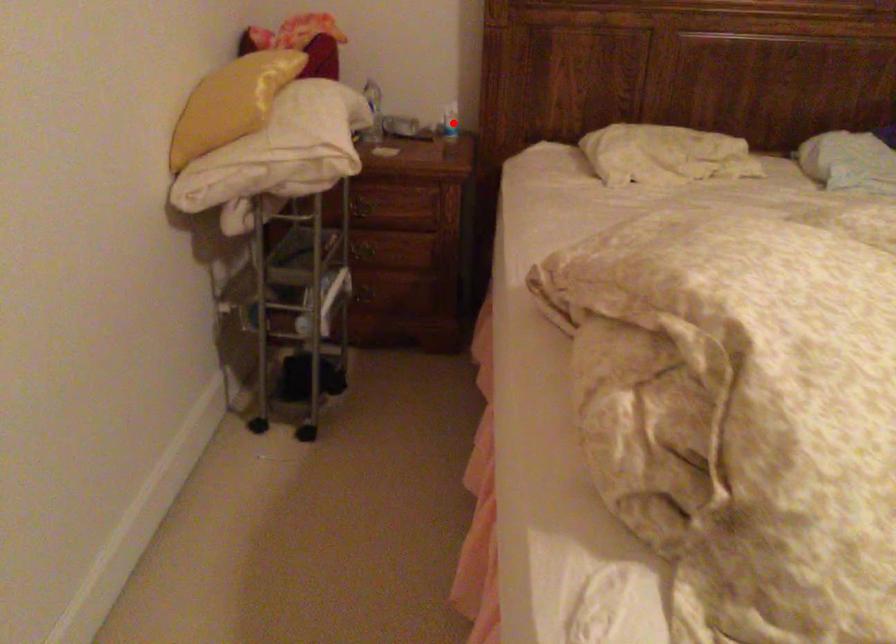
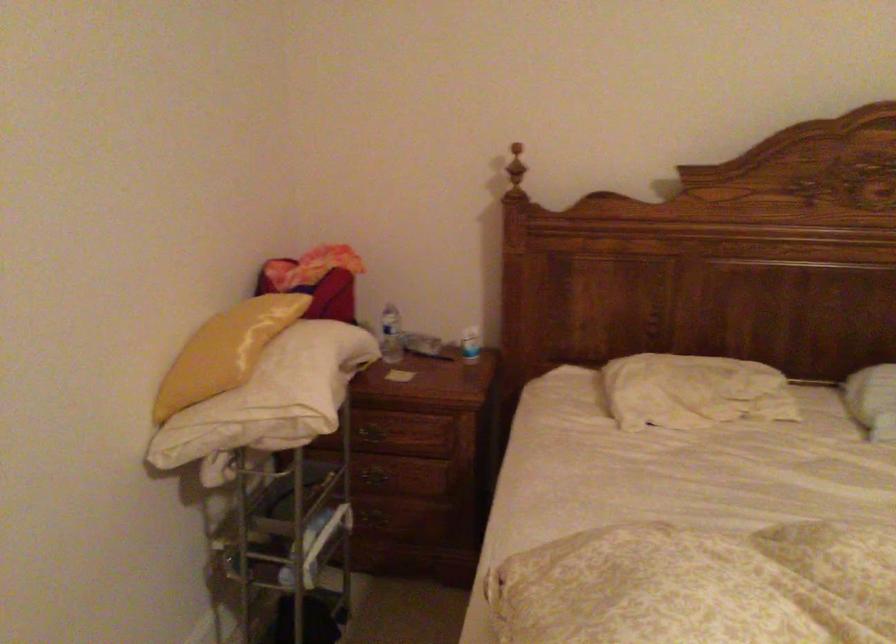
Where in the second image is the point corresponding to the highlighted location from the first image?

(470, 344)